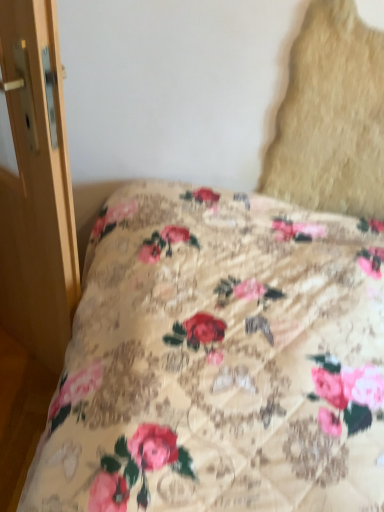
Image resolution: width=384 pixels, height=512 pixels. What do you see at coordinates (331, 117) in the screenshot? I see `beige textured pillow at upper right` at bounding box center [331, 117].

Find the location of a particular element. This screenshot has width=384, height=512. beige textured pillow at upper right is located at coordinates (331, 117).

What do you see at coordinates (36, 186) in the screenshot? I see `wooden door at left` at bounding box center [36, 186].

Locate an element on the screen. wooden door at left is located at coordinates (36, 186).

This screenshot has width=384, height=512. What are the coordinates of `beige textured pillow at upper right` in the screenshot? It's located at (331, 117).

Which is more to the left, wooden door at left or beige textured pillow at upper right?

From the viewer's perspective, wooden door at left appears more on the left side.

Is wooden door at left further to the viewer compared to beige textured pillow at upper right?

No, the depth of wooden door at left is less than that of beige textured pillow at upper right.

Does point (20, 35) come behind point (341, 157)?

No, (20, 35) is in front of (341, 157).

In the scene shown: From the image's perspective, is wooden door at left located beneath beige textured pillow at upper right?

Indeed, from the image's perspective, wooden door at left is shown beneath beige textured pillow at upper right.

From a real-world perspective, is wooden door at left under beige textured pillow at upper right?

Yes, from a real-world perspective, wooden door at left is beneath beige textured pillow at upper right.

Considering the sizes of objects wooden door at left and beige textured pillow at upper right in the image provided, who is thinner, wooden door at left or beige textured pillow at upper right?

beige textured pillow at upper right.

In terms of height, does wooden door at left look taller or shorter compared to beige textured pillow at upper right?

Clearly, wooden door at left is taller compared to beige textured pillow at upper right.

Considering the sizes of wooden door at left and beige textured pillow at upper right in the image, is wooden door at left bigger or smaller than beige textured pillow at upper right?

In the image, wooden door at left appears to be larger than beige textured pillow at upper right.

Do you think wooden door at left is within beige textured pillow at upper right, or outside of it?

wooden door at left lies outside beige textured pillow at upper right.

Would you say wooden door at left is a long distance from beige textured pillow at upper right?

wooden door at left is near beige textured pillow at upper right, not far away.

Is wooden door at left facing away from beige textured pillow at upper right?

No, wooden door at left is not facing the opposite direction of beige textured pillow at upper right.

The width and height of the screenshot is (384, 512). Identify the location of pillow located on the right of wooden door at left. (331, 117).

Which object is positioned more to the right, beige textured pillow at upper right or wooden door at left?

From the viewer's perspective, beige textured pillow at upper right appears more on the right side.

Consider the image. Is beige textured pillow at upper right further to camera compared to wooden door at left?

Yes.

Does point (331, 22) appear closer or farther from the camera than point (57, 332)?

Point (331, 22) is closer to the camera than point (57, 332).

From the image's perspective, which one is positioned lower, beige textured pillow at upper right or wooden door at left?

wooden door at left is shown below in the image.

From a real-world perspective, does beige textured pillow at upper right sit lower than wooden door at left?

Incorrect, from a real-world perspective, beige textured pillow at upper right is higher than wooden door at left.

Considering the relative sizes of beige textured pillow at upper right and wooden door at left in the image provided, is beige textured pillow at upper right wider than wooden door at left?

In fact, beige textured pillow at upper right might be narrower than wooden door at left.

From the picture: Who is shorter, beige textured pillow at upper right or wooden door at left?

beige textured pillow at upper right is shorter.

Does beige textured pillow at upper right have a smaller size compared to wooden door at left?

Yes, beige textured pillow at upper right is smaller than wooden door at left.

Is beige textured pillow at upper right inside the boundaries of wooden door at left, or outside?

The correct answer is: outside.

Consider the image. Is beige textured pillow at upper right next to wooden door at left?

beige textured pillow at upper right is not next to wooden door at left, and they're not touching.

Is beige textured pillow at upper right oriented towards wooden door at left?

No, beige textured pillow at upper right is not aimed at wooden door at left.

How distant is beige textured pillow at upper right from wooden door at left?

The distance of beige textured pillow at upper right from wooden door at left is 34.01 inches.

This screenshot has width=384, height=512. I want to click on screen door on the left of beige textured pillow at upper right, so click(36, 186).

Image resolution: width=384 pixels, height=512 pixels. In order to click on screen door in front of the beige textured pillow at upper right in this screenshot , I will do `click(36, 186)`.

Where is `pillow above the wooden door at left (from the image's perspective)`? pillow above the wooden door at left (from the image's perspective) is located at coordinates (331, 117).